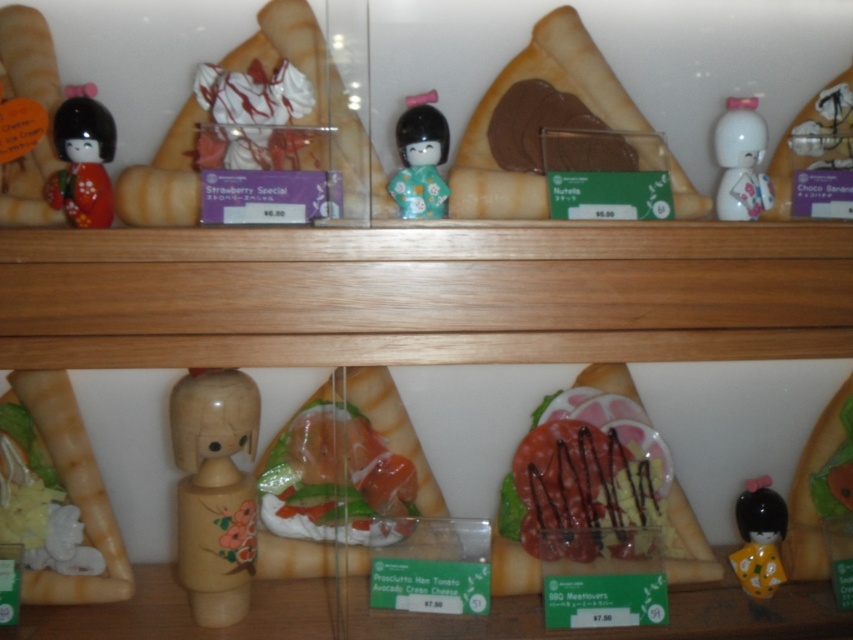
Does matte black figurine at upper left have a larger size compared to white glossy figurine at upper right?

Yes, matte black figurine at upper left is bigger than white glossy figurine at upper right.

Does matte black figurine at upper left appear on the right side of white glossy figurine at upper right?

In fact, matte black figurine at upper left is to the left of white glossy figurine at upper right.

Describe the element at coordinates (82, 163) in the screenshot. This screenshot has width=853, height=640. I see `matte black figurine at upper left` at that location.

This screenshot has width=853, height=640. What are the coordinates of `matte black figurine at upper left` in the screenshot? It's located at (82, 163).

Does translucent plastic sandwich at center appear over matte black figurine at upper left?

No.

Between translucent plastic sandwich at center and matte black figurine at upper left, which one is positioned lower?

translucent plastic sandwich at center is lower down.

Is point (345, 496) positioned after point (83, 163)?

Yes, it is behind point (83, 163).

The width and height of the screenshot is (853, 640). I want to click on translucent plastic sandwich at center, so click(335, 481).

Which is more to the left, shiny chocolate sandwich at center or matte black figurine at center?

matte black figurine at center

Who is more forward, (x=593, y=413) or (x=405, y=154)?

Point (x=405, y=154) is in front.

Where is `shiny chocolate sandwich at center`? The width and height of the screenshot is (853, 640). shiny chocolate sandwich at center is located at coordinates (593, 484).